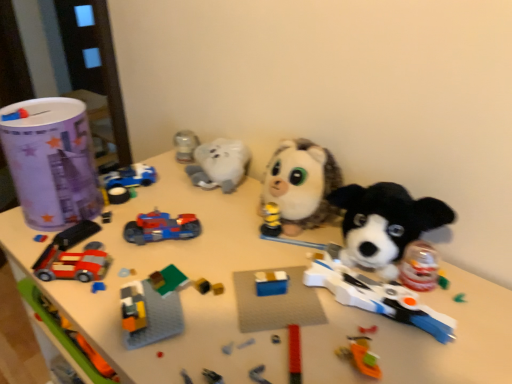
Question: From the image's perspective, is paper cup at left, the 1th toy viewed from the left, above shiny plastic toy car at center, which is counted as the second toy, starting from the right?

Choices:
 (A) no
 (B) yes

Answer: (B)

Question: Would you say paper cup at left, the 1th toy viewed from the left, is a long distance from shiny plastic toy car at center, which is counted as the second toy, starting from the right?

Choices:
 (A) no
 (B) yes

Answer: (A)

Question: Can you confirm if paper cup at left, marked as the fifth toy in a right-to-left arrangement, is bigger than shiny plastic toy car at center, the fourth toy positioned from the left?

Choices:
 (A) yes
 (B) no

Answer: (A)

Question: Is paper cup at left, the 1th toy viewed from the left, directly adjacent to shiny plastic toy car at center, the fourth toy positioned from the left?

Choices:
 (A) yes
 (B) no

Answer: (B)

Question: Is paper cup at left, marked as the fifth toy in a right-to-left arrangement, thinner than shiny plastic toy car at center, the fourth toy positioned from the left?

Choices:
 (A) yes
 (B) no

Answer: (B)

Question: Which is correct: blue plastic car at upper left, positioned as the third toy in right-to-left order, is inside brick-like plastic car at lower left, arranged as the 4th toy when viewed from the right, or outside of it?

Choices:
 (A) outside
 (B) inside

Answer: (A)

Question: From a real-world perspective, is blue plastic car at upper left, positioned as the third toy in right-to-left order, positioned above or below brick-like plastic car at lower left, the 2th toy in the left-to-right sequence?

Choices:
 (A) above
 (B) below

Answer: (B)

Question: In the image, is blue plastic car at upper left, positioned as the third toy in right-to-left order, positioned in front of or behind brick-like plastic car at lower left, the 2th toy in the left-to-right sequence?

Choices:
 (A) front
 (B) behind

Answer: (B)

Question: In terms of height, does blue plastic car at upper left, positioned as the third toy in right-to-left order, look taller or shorter compared to brick-like plastic car at lower left, the 2th toy in the left-to-right sequence?

Choices:
 (A) tall
 (B) short

Answer: (A)

Question: Which is correct: brick-like plastic car at lower left, arranged as the 4th toy when viewed from the right, is inside fluffy white plush at center, acting as the 1th toy starting from the right, or outside of it?

Choices:
 (A) inside
 (B) outside

Answer: (B)

Question: Relative to fluffy white plush at center, placed as the 5th toy when sorted from left to right, is brick-like plastic car at lower left, arranged as the 4th toy when viewed from the right, in front or behind?

Choices:
 (A) behind
 (B) front

Answer: (B)

Question: Is point click(66, 231) positioned closer to the camera than point click(260, 208)?

Choices:
 (A) closer
 (B) farther

Answer: (A)

Question: Considering the positions of brick-like plastic car at lower left, the 2th toy in the left-to-right sequence, and fluffy white plush at center, acting as the 1th toy starting from the right, in the image, is brick-like plastic car at lower left, the 2th toy in the left-to-right sequence, wider or thinner than fluffy white plush at center, acting as the 1th toy starting from the right,?

Choices:
 (A) thin
 (B) wide

Answer: (A)

Question: Is fluffy white plush at center, acting as the 1th toy starting from the right, situated inside shiny plastic toy car at center, which is counted as the second toy, starting from the right, or outside?

Choices:
 (A) outside
 (B) inside

Answer: (A)

Question: Considering the positions of fluffy white plush at center, placed as the 5th toy when sorted from left to right, and shiny plastic toy car at center, which is counted as the second toy, starting from the right, in the image, is fluffy white plush at center, placed as the 5th toy when sorted from left to right, taller or shorter than shiny plastic toy car at center, which is counted as the second toy, starting from the right,?

Choices:
 (A) short
 (B) tall

Answer: (B)